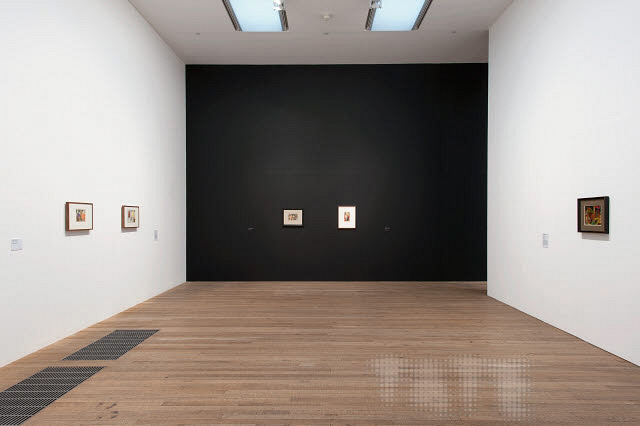
At what (x,y) coordinates should I click in order to perform the action: click on 1 white wall on the left. Please return your answer as a coordinate pair (x, y). Looking at the image, I should click on (77, 124).